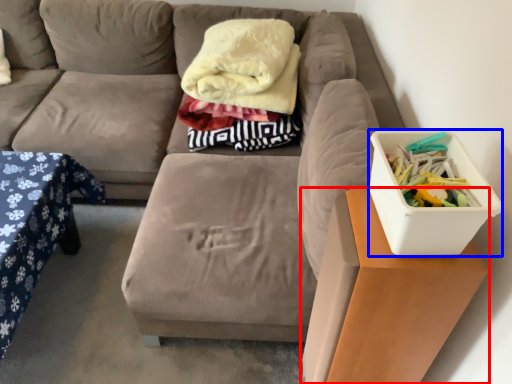
Question: Which object is closer to the camera taking this photo, table (highlighted by a red box) or storage box (highlighted by a blue box)?

Choices:
 (A) table
 (B) storage box

Answer: (B)